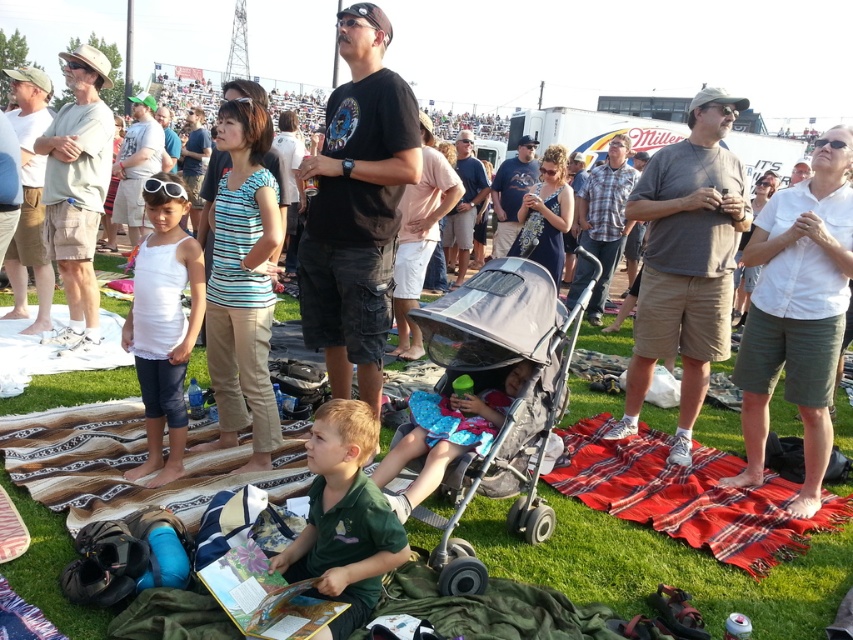
Question: Among these objects, which one is nearest to the camera?

Choices:
 (A) plaid cotton shirt at center
 (B) matte black t-shirt at center

Answer: (A)

Question: Based on their relative distances, which object is farther from the matte black stroller at center?

Choices:
 (A) khaki cotton shorts at left
 (B) white shirt at center
 (C) red plaid blanket at lower right
 (D) matte green cap at upper center

Answer: (A)

Question: Does green grass at center have a lesser width compared to matte black stroller at center?

Choices:
 (A) yes
 (B) no

Answer: (B)

Question: From the image, what is the correct spatial relationship of plaid cotton shirt at center in relation to matte green cap at upper center?

Choices:
 (A) below
 (B) above

Answer: (A)

Question: Which point is closer to the camera taking this photo?

Choices:
 (A) (444, 237)
 (B) (721, 170)
 (C) (784, 228)
 (D) (25, 196)

Answer: (C)

Question: Is gray fabric stroller at center wider than plaid cotton shirt at center?

Choices:
 (A) yes
 (B) no

Answer: (A)